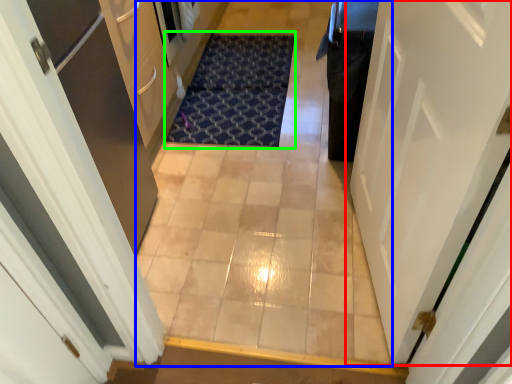
Question: Which object is the closest to the door (highlighted by a red box)? Choose among these: corridor (highlighted by a blue box) or doormat (highlighted by a green box).

Choices:
 (A) corridor
 (B) doormat

Answer: (A)